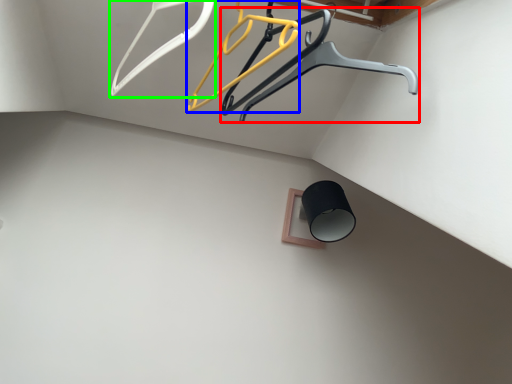
Question: Which is farther away from furniture (highlighted by a red box)? hanger (highlighted by a blue box) or hanger (highlighted by a green box)?

Choices:
 (A) hanger
 (B) hanger

Answer: (B)